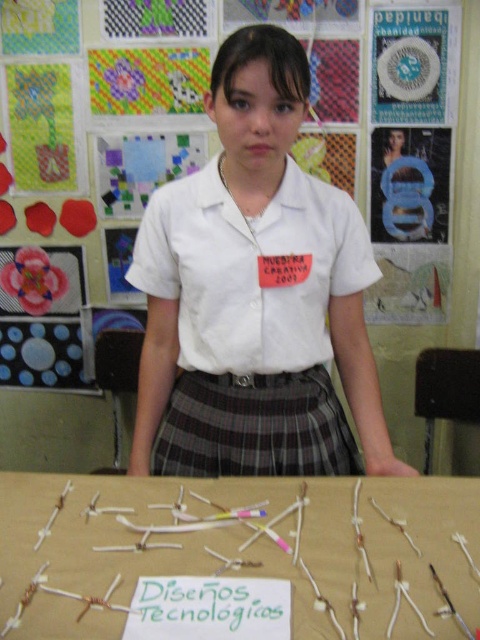
Does point (151, 369) lie in front of point (147, 486)?

That is False.

Is point (142, 356) positioned in front of point (423, 556)?

No, (142, 356) is behind (423, 556).

You are a GUI agent. You are given a task and a screenshot of the screen. Output one action in this format:
    pyautogui.click(x=<x>, y=<y>)
    Task: Click on the white plaid skirt at center
    The height and width of the screenshot is (640, 480).
    Given the screenshot: What is the action you would take?
    pyautogui.click(x=255, y=294)

Who is shorter, white plaid skirt at center or plaid fabric skirt at center?

plaid fabric skirt at center

From the picture: Is white plaid skirt at center shorter than plaid fabric skirt at center?

In fact, white plaid skirt at center may be taller than plaid fabric skirt at center.

What do you see at coordinates (255, 294) in the screenshot? I see `white plaid skirt at center` at bounding box center [255, 294].

You are a GUI agent. You are given a task and a screenshot of the screen. Output one action in this format:
    pyautogui.click(x=<x>, y=<y>)
    Task: Click on the white plaid skirt at center
    Image resolution: width=480 pixels, height=640 pixels.
    Given the screenshot: What is the action you would take?
    pyautogui.click(x=255, y=294)

Between white plaid skirt at center and white cotton shirt at center, which one has less height?

white cotton shirt at center

Which is behind, point (332, 336) or point (192, 202)?

Point (332, 336)

Is point (263, 248) more distant than point (144, 292)?

No, it is in front of (144, 292).

In order to click on white plaid skirt at center in this screenshot , I will do `click(255, 294)`.